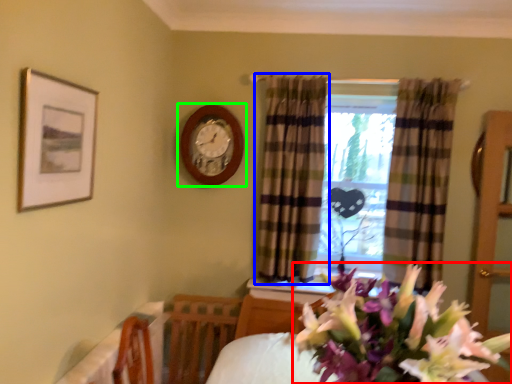
Question: Which is farther away from flower (highlighted by a red box)? curtain (highlighted by a blue box) or wall clock (highlighted by a green box)?

Choices:
 (A) curtain
 (B) wall clock

Answer: (B)